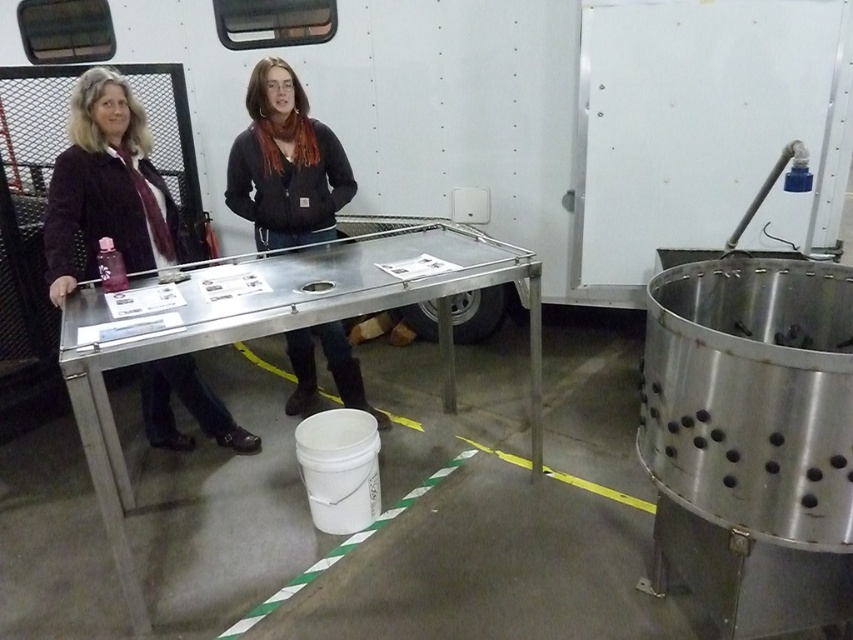
You are standing at the entrance of the winery and see the matte black jacket at left on the stainless steel table. Can you determine if the jacket is positioned closer to the yellow lines or the green lines on the floor?

The matte black jacket at left is located at point (107, 186), which is closer to the yellow lines than the green lines on the floor.

You are an event organizer arranging a wine tasting event. You need to place a sign on the table between the two people wearing matte black jackets. Where should you place the sign so it is equidistant from both the matte black jacket at left and the matte black jacket at center?

The sign should be placed exactly halfway between the matte black jacket at left and the matte black jacket at center since the matte black jacket at left is positioned on the left side of the matte black jacket at center.

You are a photographer at the winery event and need to capture both the matte black jacket at left and the matte black jacket at center in a single shot. Given their height difference, which jacket should you focus on to ensure both are in frame without cropping?

The matte black jacket at left is much taller than the matte black jacket at center, so focusing on the matte black jacket at left will ensure both are visible in the frame without cropping.